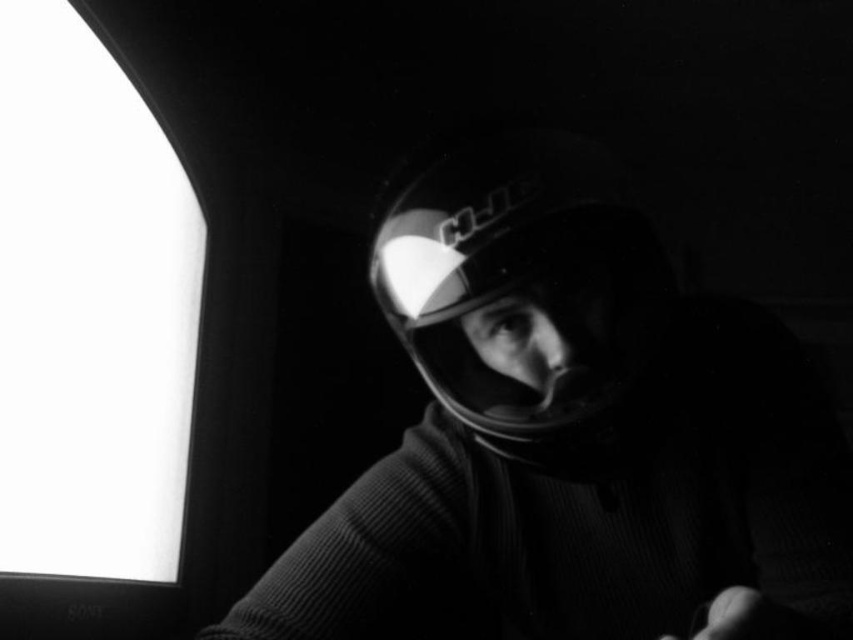
You are setting up a desk in a dark room. You have a white glossy computer monitor at left and a glossy plastic helmet at center. Which object is taller?

The white glossy computer monitor at left is taller than the glossy plastic helmet at center.

You are a photographer adjusting lighting in a studio. You notice the matte black helmet at center and the white glossy computer monitor at left. Which object is closer to the light source based on their reflections?

The white glossy computer monitor at left has a more reflective surface, indicating it is closer to the light source than the matte black helmet at center.